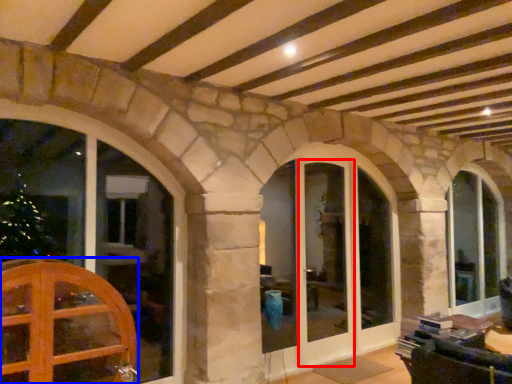
Question: Among these objects, which one is farthest to the camera, screen door (highlighted by a red box) or door (highlighted by a blue box)?

Choices:
 (A) screen door
 (B) door

Answer: (A)